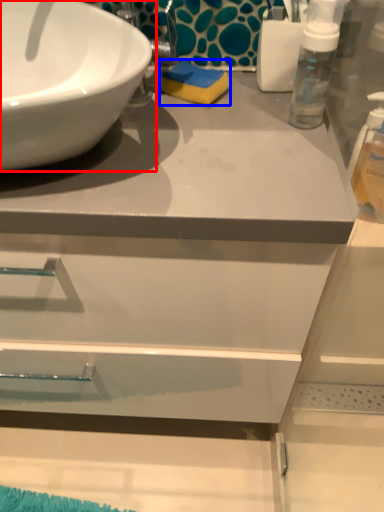
Question: Which object is closer to the camera taking this photo, sink (highlighted by a red box) or soap (highlighted by a blue box)?

Choices:
 (A) sink
 (B) soap

Answer: (A)